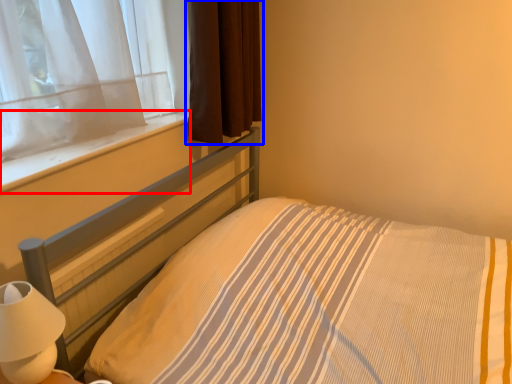
Question: Among these objects, which one is nearest to the camera, window sill (highlighted by a red box) or curtain (highlighted by a blue box)?

Choices:
 (A) window sill
 (B) curtain

Answer: (A)